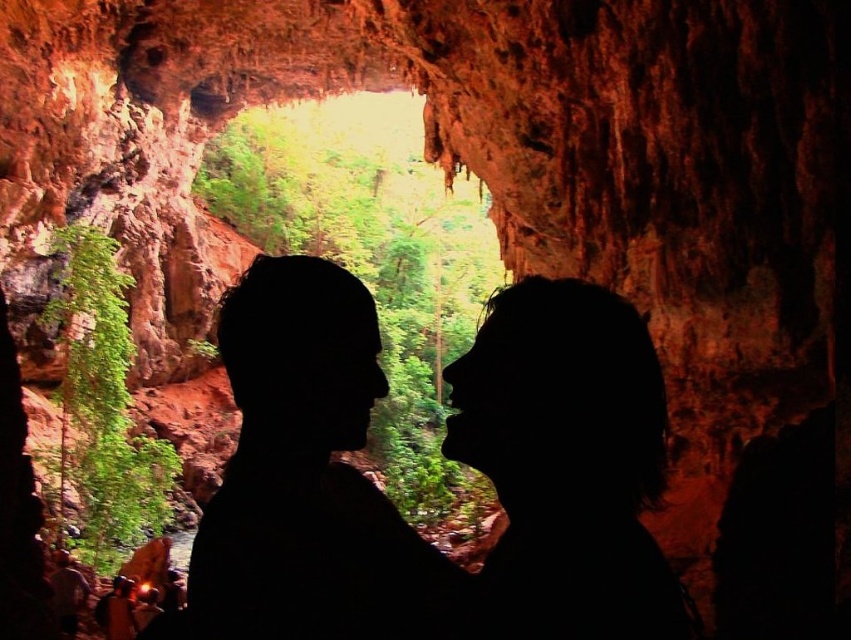
You are a photographer trying to capture the scene inside the cave. You notice two elements in the center of the image, the black silhouette couple at center and the silhouette hair at center. Based on their positions, which one is closer to the left side of the image?

The black silhouette couple at center is positioned to the left of the silhouette hair at center, so the black silhouette couple at center is closer to the left side of the image.

You are an explorer inside the cave and want to take a photo of the black silhouette couple at center and the silhouette hair at center. Which object should you focus on first if you want to capture both in sharp focus?

The black silhouette couple at center is taller than the silhouette hair at center, so you should focus on the black silhouette couple at center first to ensure both are in sharp focus.